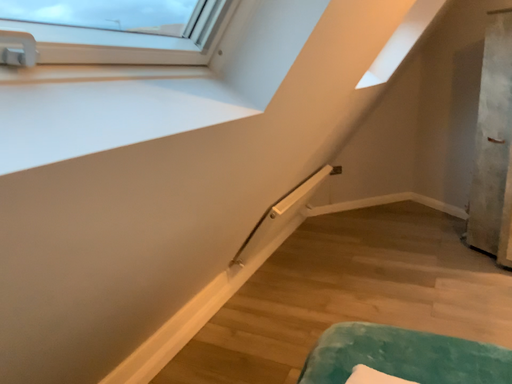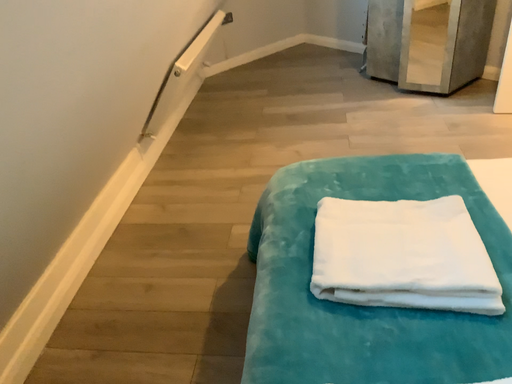
Question: Which way did the camera rotate in the video?

Choices:
 (A) rotated right
 (B) rotated left

Answer: (A)